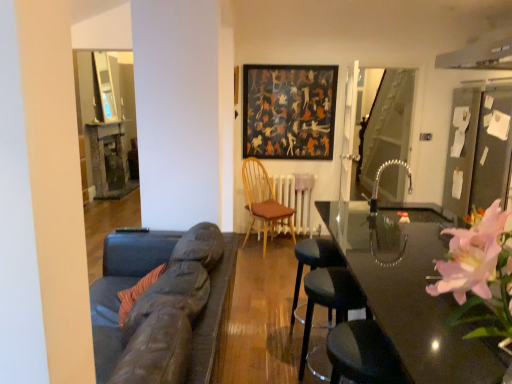
Image resolution: width=512 pixels, height=384 pixels. Find the location of `empty space that is ontop of black leather swivel chair at lower right (from a real-world perspective)`. empty space that is ontop of black leather swivel chair at lower right (from a real-world perspective) is located at coordinates (366, 344).